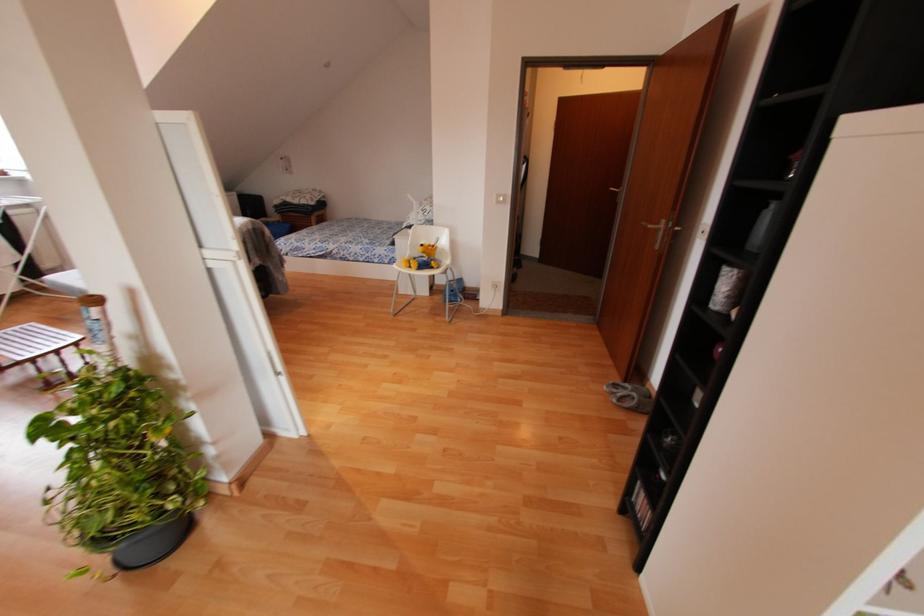
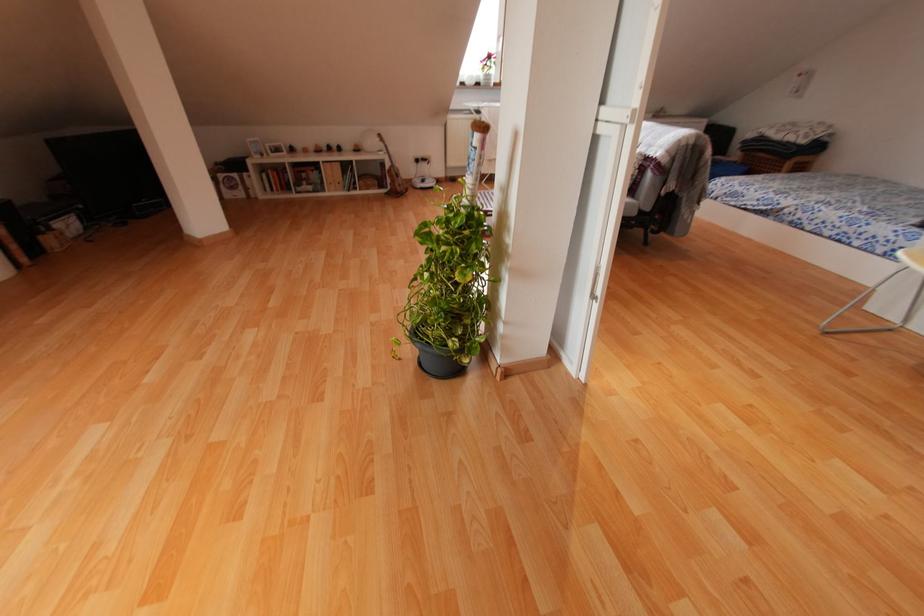
How did the camera likely rotate?

The camera rotated toward left-down.